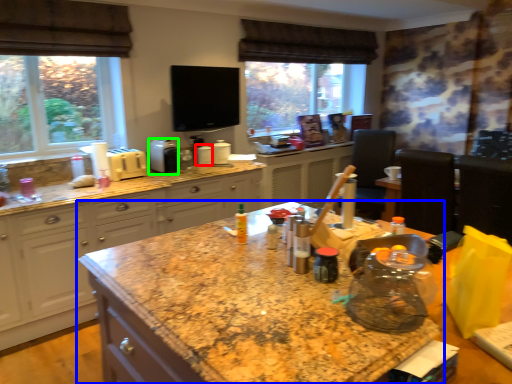
Question: Considering the real-world distances, which object is closest to appliance (highlighted by a red box)? countertop (highlighted by a blue box) or appliance (highlighted by a green box).

Choices:
 (A) countertop
 (B) appliance

Answer: (B)